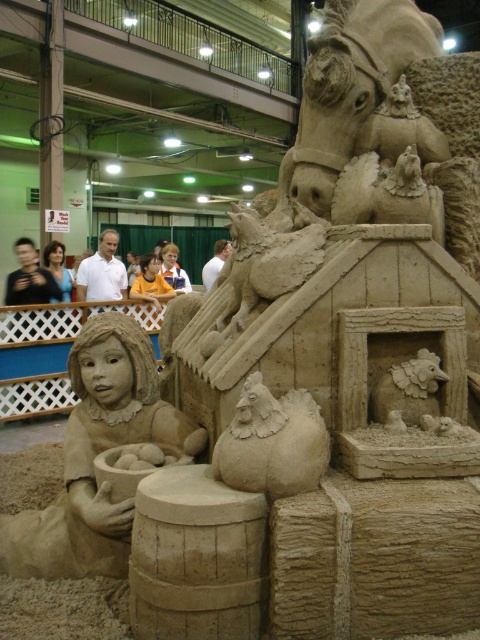
Question: Can you confirm if yellow shirt at center is positioned below orange shirt at center?

Choices:
 (A) yes
 (B) no

Answer: (A)

Question: Estimate the real-world distances between objects in this image. Which object is closer to the matte black hair at center?

Choices:
 (A) orange shirt at center
 (B) smooth beige rooster at center
 (C) white shirt at center
 (D) smooth sand girl at lower left

Answer: (C)

Question: Can you confirm if white shirt at center is positioned to the left of white shirt at upper center?

Choices:
 (A) yes
 (B) no

Answer: (A)

Question: Considering the real-world distances, which object is farthest from the smooth sand girl at lower left?

Choices:
 (A) white shirt at center
 (B) yellow shirt at center
 (C) white shirt at upper center

Answer: (C)

Question: Which object is positioned closest to the white shirt at upper center?

Choices:
 (A) smooth sand girl at lower left
 (B) matte black hair at center
 (C) orange shirt at center
 (D) yellow shirt at center

Answer: (C)

Question: Does smooth beige rooster at center appear over white shirt at center?

Choices:
 (A) no
 (B) yes

Answer: (A)